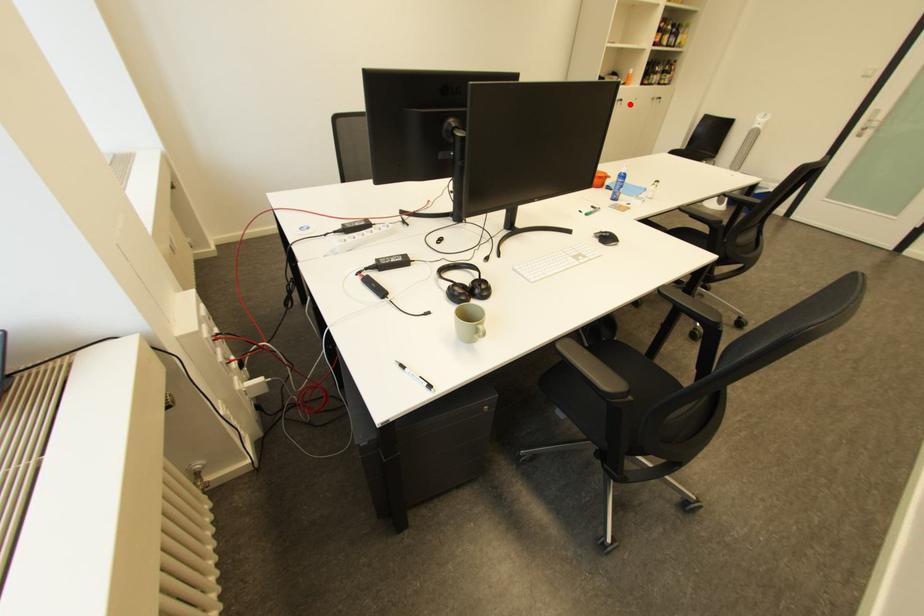
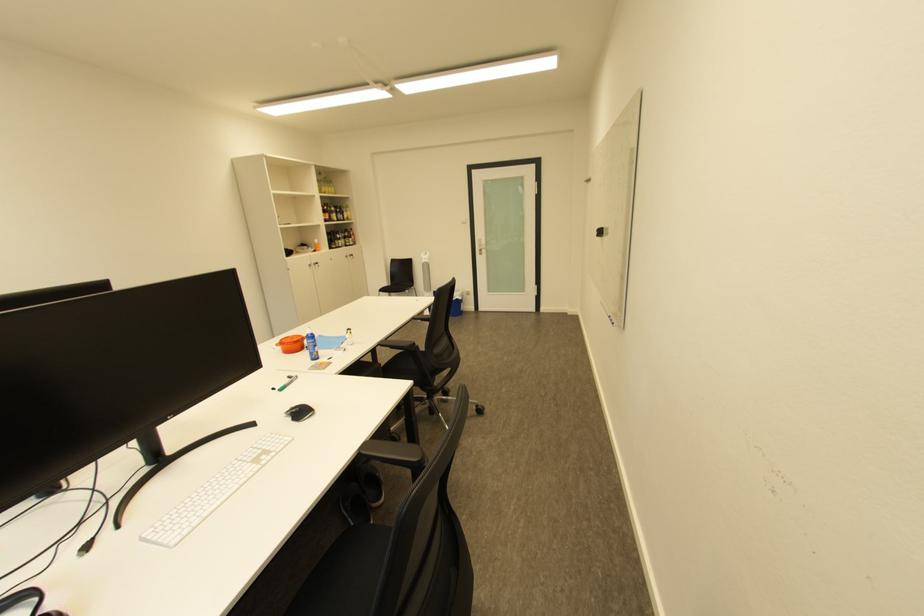
Locate, in the second image, the point that corresponds to the highlighted location in the first image.

(329, 267)